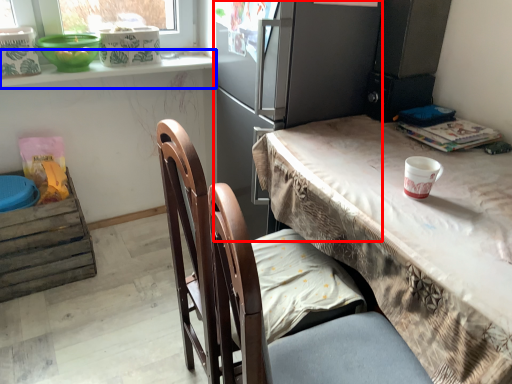
Question: Which point is further to the camera, fridge (highlighted by a red box) or window sill (highlighted by a blue box)?

Choices:
 (A) fridge
 (B) window sill

Answer: (B)